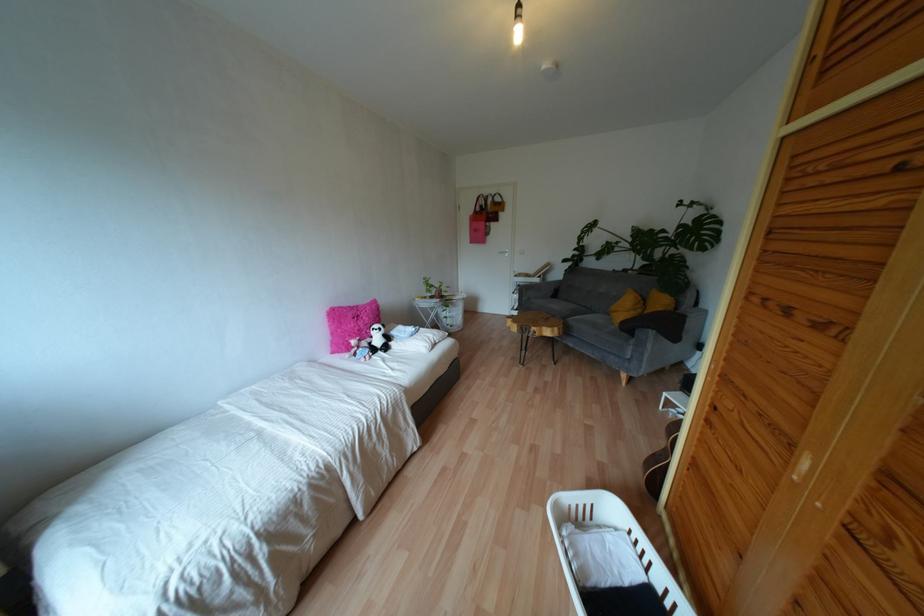
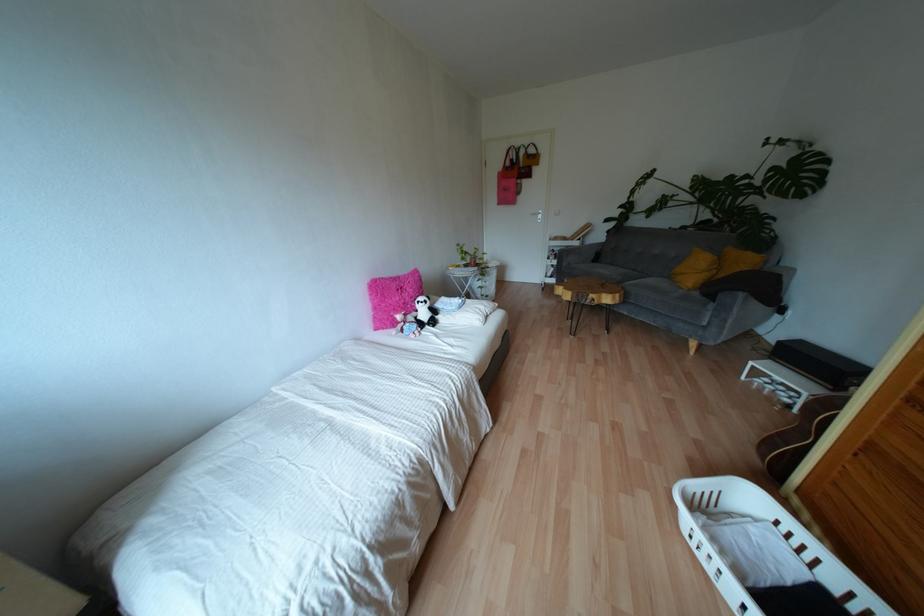
The images are taken continuously from a first-person perspective. In which direction are you moving?

The cameraman moved toward left, forward.